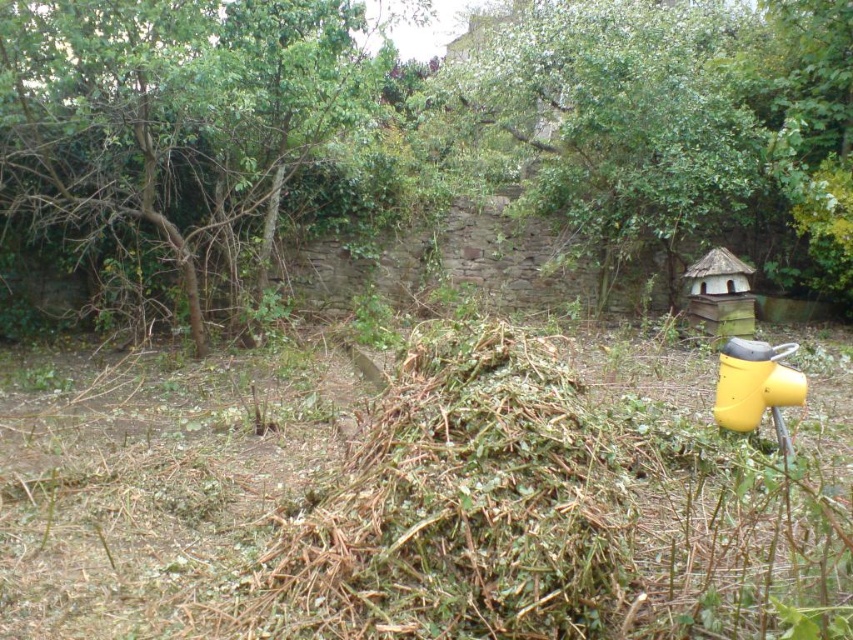
This screenshot has height=640, width=853. I want to click on yellow plastic hydrant at lower right, so click(x=756, y=387).

How distant is yellow plastic hydrant at lower right from wooden hut at right?

yellow plastic hydrant at lower right and wooden hut at right are 4.29 meters apart from each other.

Image resolution: width=853 pixels, height=640 pixels. What do you see at coordinates (756, 387) in the screenshot?
I see `yellow plastic hydrant at lower right` at bounding box center [756, 387].

Find the location of a particular element. This screenshot has width=853, height=640. yellow plastic hydrant at lower right is located at coordinates (756, 387).

Who is shorter, green leafy tree at upper center or yellow plastic hydrant at lower right?

yellow plastic hydrant at lower right is shorter.

Is green leafy tree at upper center positioned in front of yellow plastic hydrant at lower right?

No, green leafy tree at upper center is further to the viewer.

Between point (445, 92) and point (778, 369), which one is positioned in front?

Positioned in front is point (778, 369).

Locate an element on the screen. Image resolution: width=853 pixels, height=640 pixels. green leafy tree at upper center is located at coordinates (618, 118).

The height and width of the screenshot is (640, 853). Describe the element at coordinates (178, 108) in the screenshot. I see `green leafy tree at upper left` at that location.

Identify the location of green leafy tree at upper left. Image resolution: width=853 pixels, height=640 pixels. (178, 108).